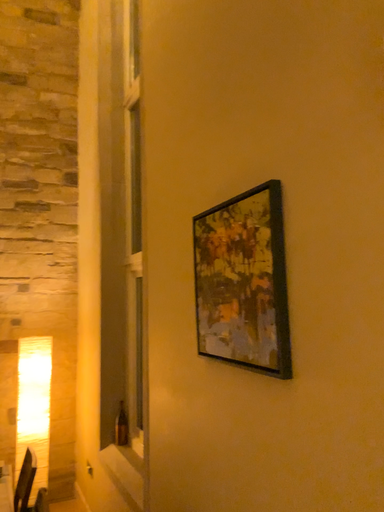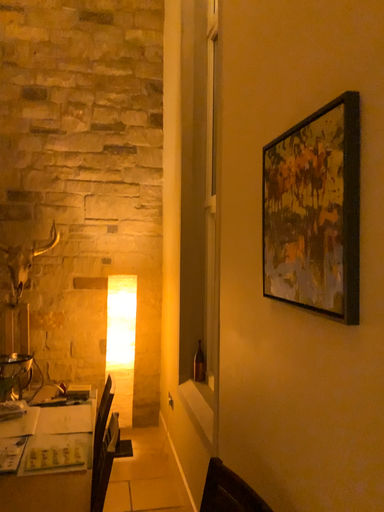
Question: How did the camera likely rotate when shooting the video?

Choices:
 (A) rotated left
 (B) rotated right

Answer: (A)